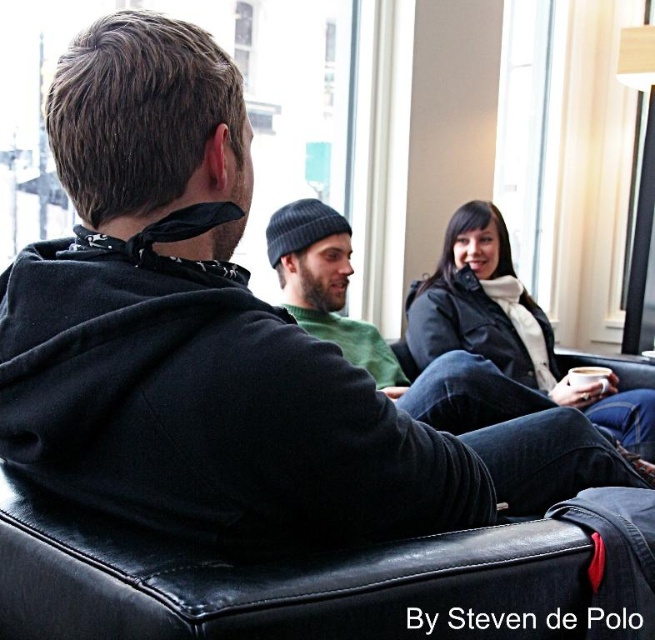
You are a photographer trying to capture a closeup of the green knit beanie at center without including the matte black jacket at center in the frame. Based on their sizes, do you think this is possible?

The matte black jacket at center is larger in size than the green knit beanie at center, so it might be challenging to frame the green knit beanie at center without including the matte black jacket at center due to its larger size.

In the scene, there are two items of clothing at center. The matte black jacket at center and the green knit beanie at center. Which one is located to the right of the other?

The matte black jacket at center is positioned on the right side of green knit beanie at center.

In the image, there are three people on a black leather couch. The person in the back is wearing a dark hoodie with a black bandana, the middle person has a green sweater and dark beanie, and the third person is wearing a matte black jacket at center. Which of these three individuals is located at the coordinate point [510,326]?

The matte black jacket at center is represented by point [510,326], so the third person wearing the matte black jacket at center is located at that coordinate.